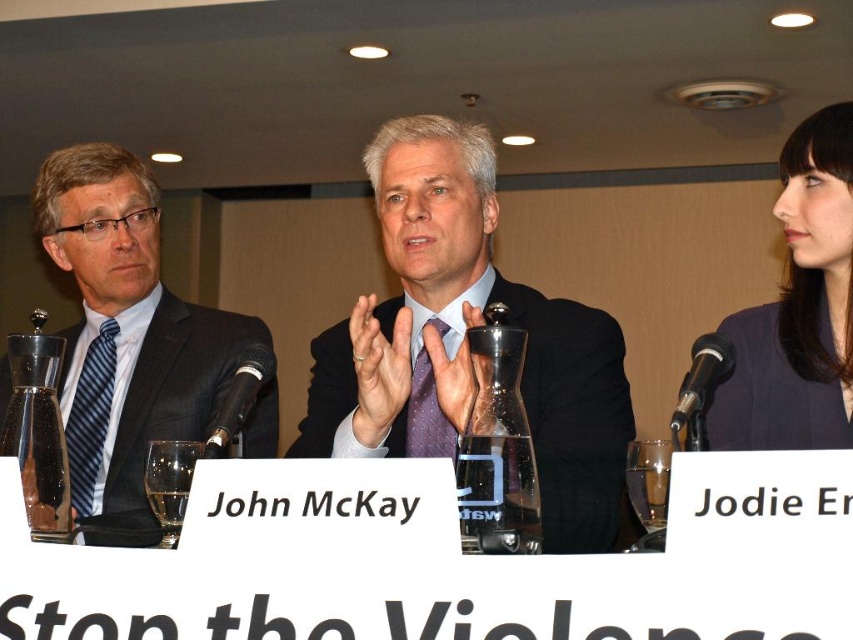
Is matte black suit at center positioned at the back of matte black suit at left?

No.

Does matte black suit at center appear on the left side of matte black suit at left?

No, matte black suit at center is not to the left of matte black suit at left.

Identify the location of matte black suit at center. Image resolution: width=853 pixels, height=640 pixels. (465, 342).

Where is `matte black suit at center`? This screenshot has height=640, width=853. matte black suit at center is located at coordinates (465, 342).

Who is more distant from viewer, (157, 380) or (264, 364)?

Positioned behind is point (157, 380).

Who is shorter, matte black suit at left or black plastic microphone at center?

Standing shorter between the two is black plastic microphone at center.

This screenshot has width=853, height=640. Describe the element at coordinates (126, 330) in the screenshot. I see `matte black suit at left` at that location.

The image size is (853, 640). What are the coordinates of `matte black suit at left` in the screenshot? It's located at coord(126,330).

Is black metallic microphone at right positioned behind black plastic microphone at center?

No, black metallic microphone at right is in front of black plastic microphone at center.

Does black metallic microphone at right have a greater width compared to black plastic microphone at center?

Indeed, black metallic microphone at right has a greater width compared to black plastic microphone at center.

You are a GUI agent. You are given a task and a screenshot of the screen. Output one action in this format:
    pyautogui.click(x=<x>, y=<y>)
    Task: Click on the black metallic microphone at right
    This screenshot has height=640, width=853.
    Given the screenshot: What is the action you would take?
    pyautogui.click(x=700, y=387)

You are a GUI agent. You are given a task and a screenshot of the screen. Output one action in this format:
    pyautogui.click(x=<x>, y=<y>)
    Task: Click on the black metallic microphone at right
    Image resolution: width=853 pixels, height=640 pixels.
    Given the screenshot: What is the action you would take?
    pyautogui.click(x=700, y=387)